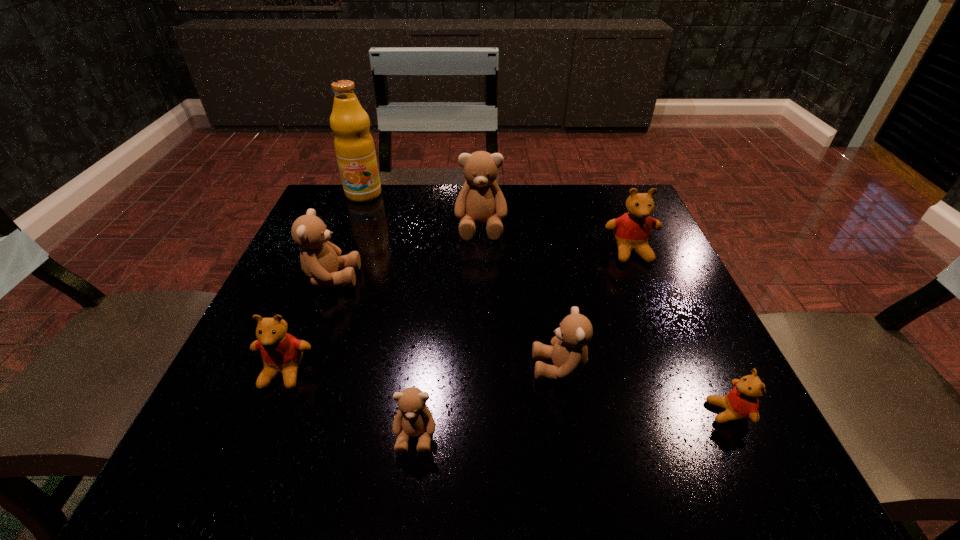
Identify the location of vacant region at the near edge of the desktop. (351, 454).

At what (x,y) coordinates should I click in order to perform the action: click on vacant space at the left edge of the desktop. Please return your answer as a coordinate pair (x, y). The width and height of the screenshot is (960, 540). Looking at the image, I should click on (293, 275).

Locate an element on the screen. The width and height of the screenshot is (960, 540). vacant region at the right edge of the desktop is located at coordinates pos(670,295).

Image resolution: width=960 pixels, height=540 pixels. I want to click on free space at the far left corner of the desktop, so click(x=323, y=202).

Identify the location of free space at the near left corner of the desktop. The width and height of the screenshot is (960, 540). (219, 450).

Locate an element on the screen. The image size is (960, 540). vacant space at the far right corner of the desktop is located at coordinates (627, 188).

The height and width of the screenshot is (540, 960). I want to click on free space that is in between the smallest red teddy bear and the biggest red teddy bear, so click(680, 332).

At what (x,y) coordinates should I click in order to perform the action: click on free space between the third nearest brown teddy bear and the third teddy bear from right to left. Please return your answer as a coordinate pair (x, y). The width and height of the screenshot is (960, 540). Looking at the image, I should click on (445, 322).

Identify the location of empty location between the smallest red teddy bear and the second tallest object. Image resolution: width=960 pixels, height=540 pixels. (605, 319).

What are the coordinates of `free space that is in between the fourth teddy bear from right to left and the third nearest brown teddy bear` in the screenshot? It's located at (406, 252).